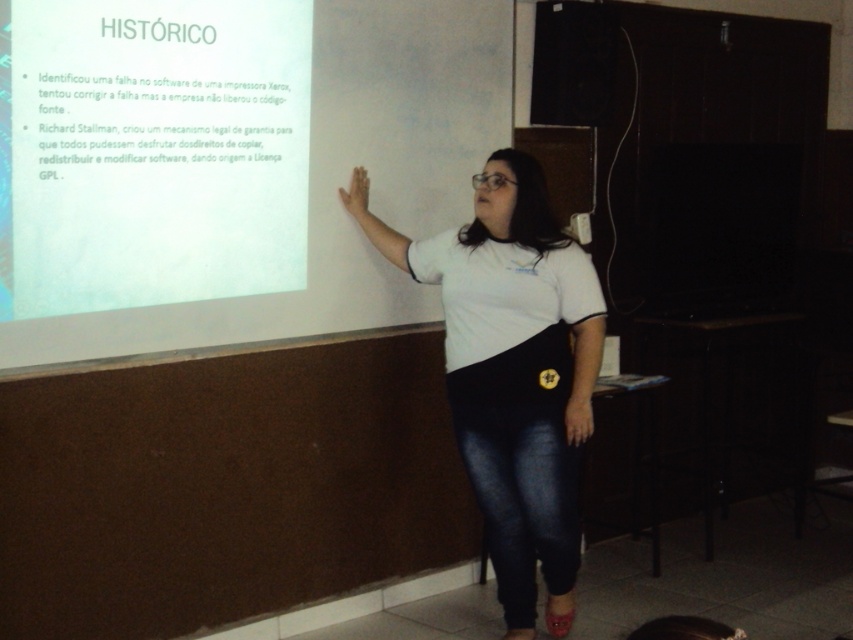
Question: Is white matte projection screen at upper left in front of white matte t-shirt at center?

Choices:
 (A) no
 (B) yes

Answer: (B)

Question: Can you confirm if white matte projection screen at upper left is positioned above white matte t-shirt at center?

Choices:
 (A) yes
 (B) no

Answer: (A)

Question: Which point appears farthest from the camera in this image?

Choices:
 (A) (88, 348)
 (B) (519, 300)

Answer: (B)

Question: Which of the following is the closest to the observer?

Choices:
 (A) white matte projection screen at upper left
 (B) white matte t-shirt at center

Answer: (A)

Question: Is white matte projection screen at upper left above white matte t-shirt at center?

Choices:
 (A) no
 (B) yes

Answer: (B)